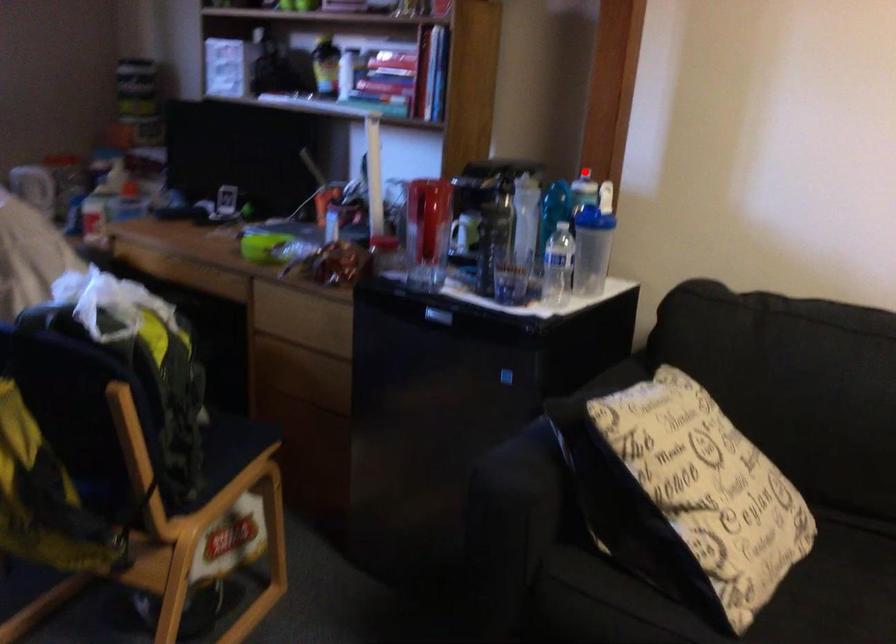
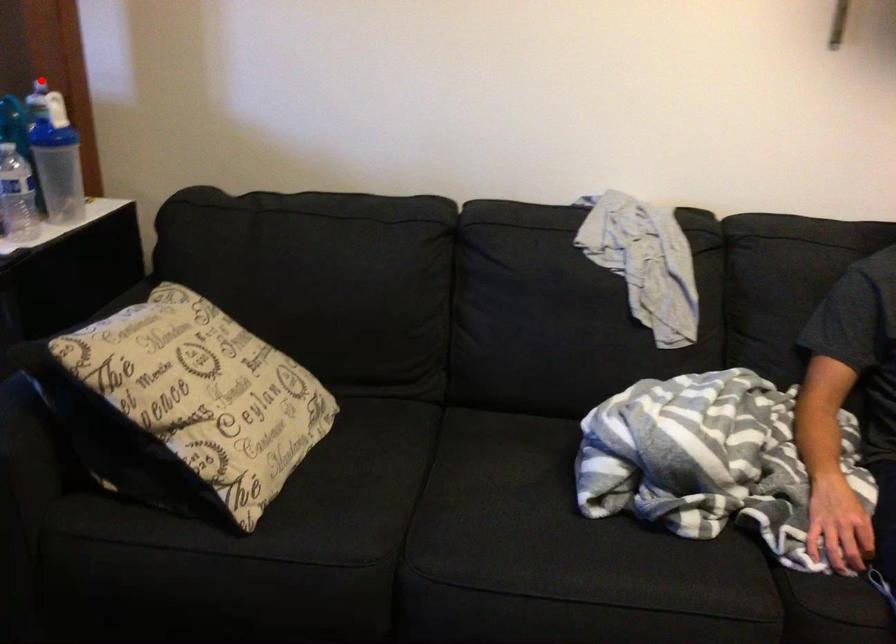
I am providing you with two images of the same scene from different viewpoints. A red point is marked on the first image and another point is marked on the second image. Is the marked point in image1 the same physical position as the marked point in image2?

Yes